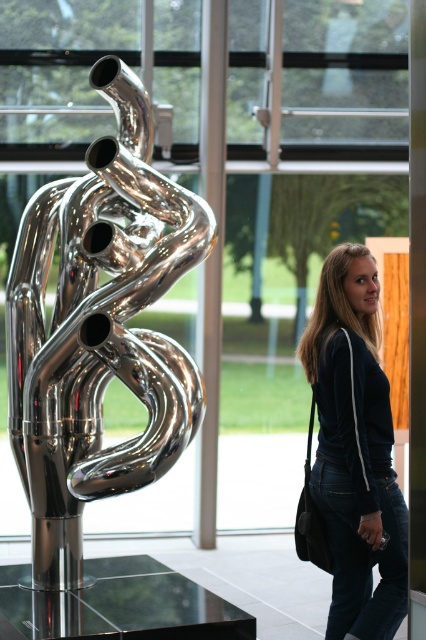
Question: Does polished metallic sculpture at left have a smaller size compared to dark blue denim jeans at lower right?

Choices:
 (A) no
 (B) yes

Answer: (A)

Question: Among these points, which one is farthest from the camera?

Choices:
 (A) (363, 609)
 (B) (32, 320)

Answer: (A)

Question: Does polished metallic sculpture at left have a greater width compared to dark blue denim jeans at lower right?

Choices:
 (A) yes
 (B) no

Answer: (A)

Question: Which point appears farthest from the camera in this image?

Choices:
 (A) (17, 388)
 (B) (340, 364)

Answer: (B)

Question: Among these objects, which one is farthest from the camera?

Choices:
 (A) dark blue denim jeans at lower right
 (B) polished metallic sculpture at left

Answer: (A)

Question: Is polished metallic sculpture at left above dark blue denim jeans at lower right?

Choices:
 (A) yes
 (B) no

Answer: (A)